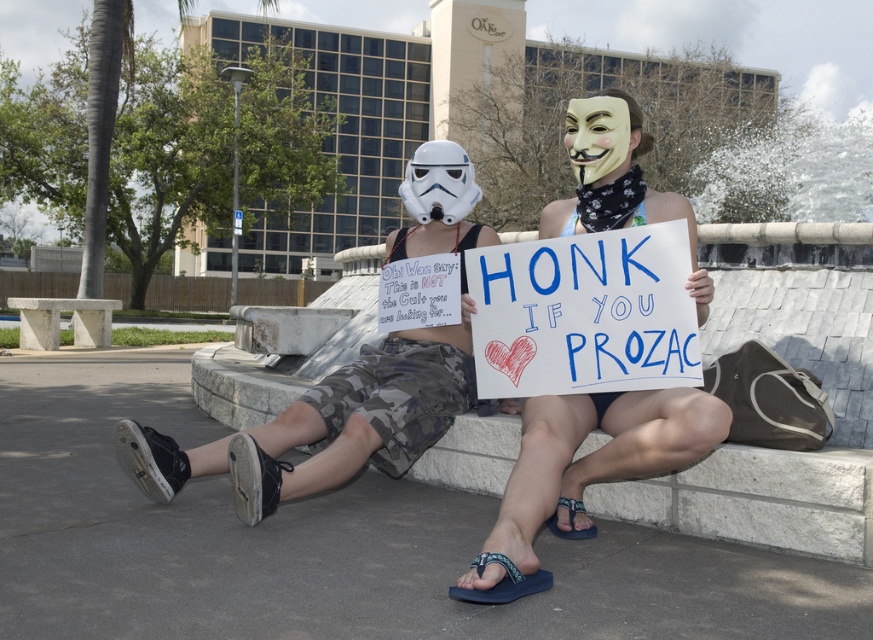
Question: Does camouflage shorts at center have a smaller size compared to white cardboard sign at center?

Choices:
 (A) no
 (B) yes

Answer: (A)

Question: Which object appears farthest from the camera in this image?

Choices:
 (A) matte white helmet at center
 (B) white cardboard sign at center

Answer: (A)

Question: Is camouflage shorts at center to the left of white cardboard sign at center from the viewer's perspective?

Choices:
 (A) yes
 (B) no

Answer: (A)

Question: Which of the following is the closest to the observer?

Choices:
 (A) white cardboard sign at center
 (B) camouflage shorts at center
 (C) matte white helmet at center

Answer: (A)

Question: Which point is closer to the camera taking this photo?

Choices:
 (A) (428, 202)
 (B) (600, 228)
 (C) (218, 448)

Answer: (B)

Question: Does camouflage shorts at center have a smaller size compared to white cardboard sign at center?

Choices:
 (A) no
 (B) yes

Answer: (A)